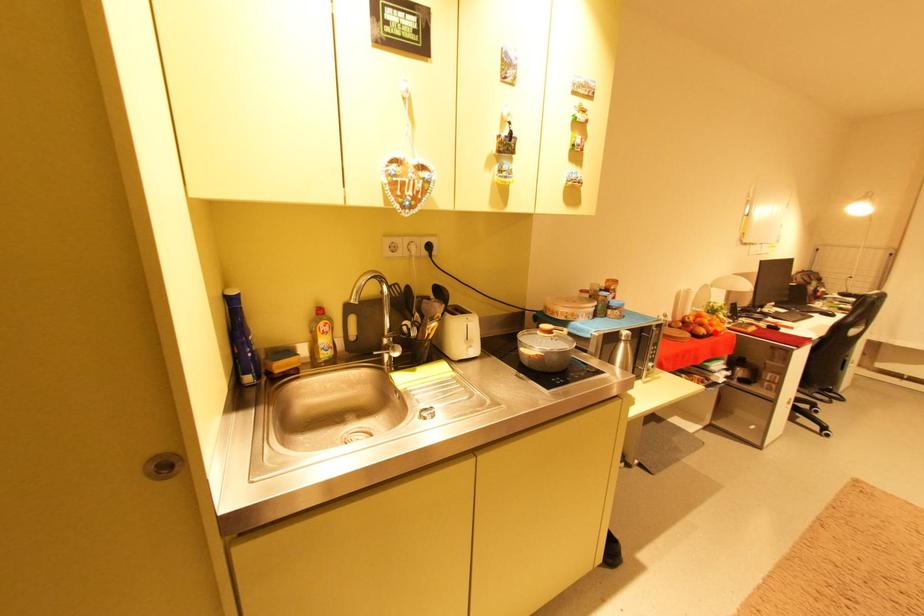
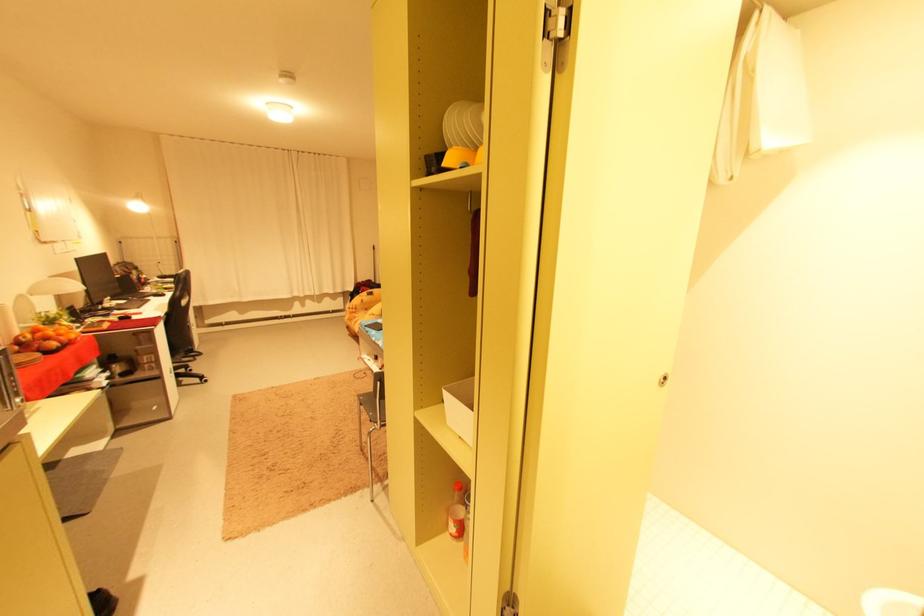
Find the pixel in the second image that matches the highlighted location in the first image.

(68, 344)